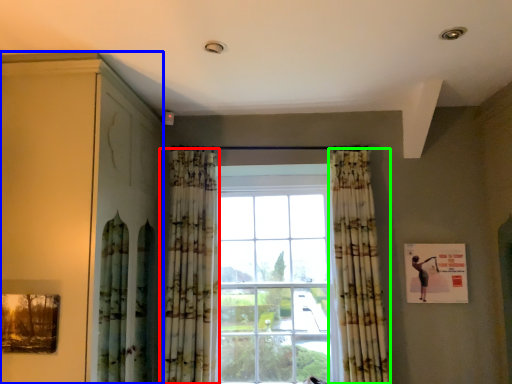
Question: Estimate the real-world distances between objects in this image. Which object is farther from curtain (highlighted by a red box), dresser (highlighted by a blue box) or curtain (highlighted by a green box)?

Choices:
 (A) dresser
 (B) curtain

Answer: (B)